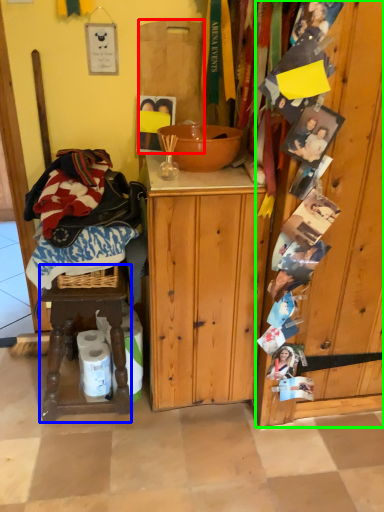
Question: Which object is positioned farthest from cutting board (highlighted by a red box)? Select from stool (highlighted by a blue box) and barn door (highlighted by a green box).

Choices:
 (A) stool
 (B) barn door

Answer: (A)